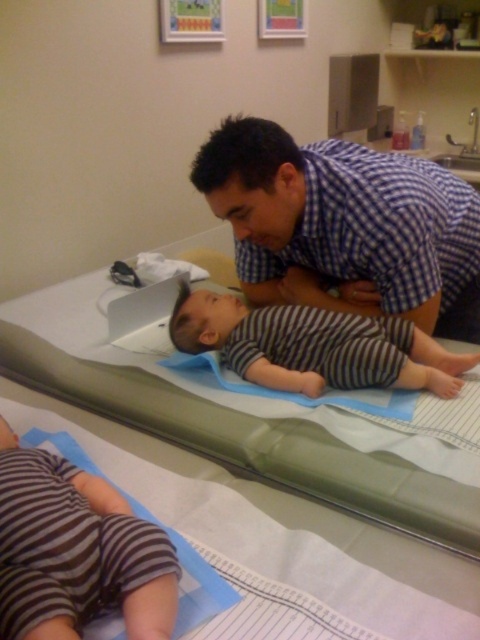
Question: Can you confirm if blue checkered shirt at upper center is positioned to the left of green fabric bed at upper center?

Choices:
 (A) no
 (B) yes

Answer: (A)

Question: Which of the following is the farthest from the observer?

Choices:
 (A) (336, 349)
 (B) (52, 301)
 (C) (74, 524)
 (D) (330, 240)

Answer: (B)

Question: In this image, where is striped cotton pants at lower left located relative to striped fabric baby at center?

Choices:
 (A) right
 (B) left

Answer: (B)

Question: Which object appears farthest from the camera in this image?

Choices:
 (A) striped fabric baby at center
 (B) striped cotton pants at lower left
 (C) blue checkered shirt at upper center

Answer: (A)

Question: Which of these objects is positioned closest to the green fabric bed at upper center?

Choices:
 (A) blue checkered shirt at upper center
 (B) striped fabric baby at center

Answer: (B)

Question: Is green fabric bed at upper center to the right of striped fabric baby at center from the viewer's perspective?

Choices:
 (A) no
 (B) yes

Answer: (A)